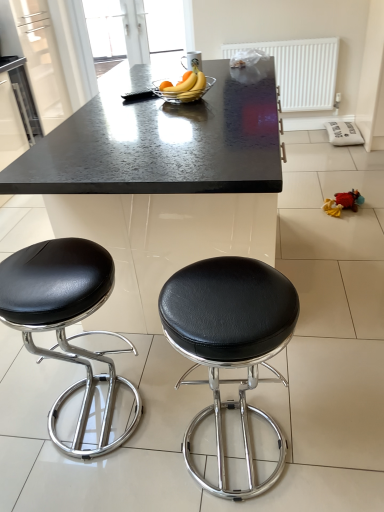
Where is `free spot above white textured radiator at upper center (from a real-world perspective)`? Image resolution: width=384 pixels, height=512 pixels. free spot above white textured radiator at upper center (from a real-world perspective) is located at coordinates (276, 37).